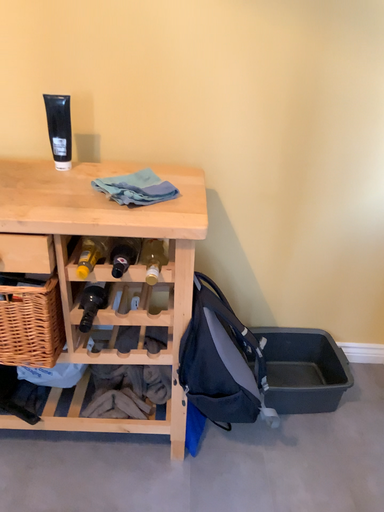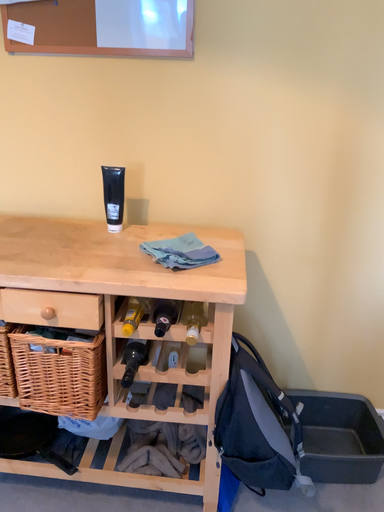
Question: Which way did the camera rotate in the video?

Choices:
 (A) rotated upward
 (B) rotated downward

Answer: (A)